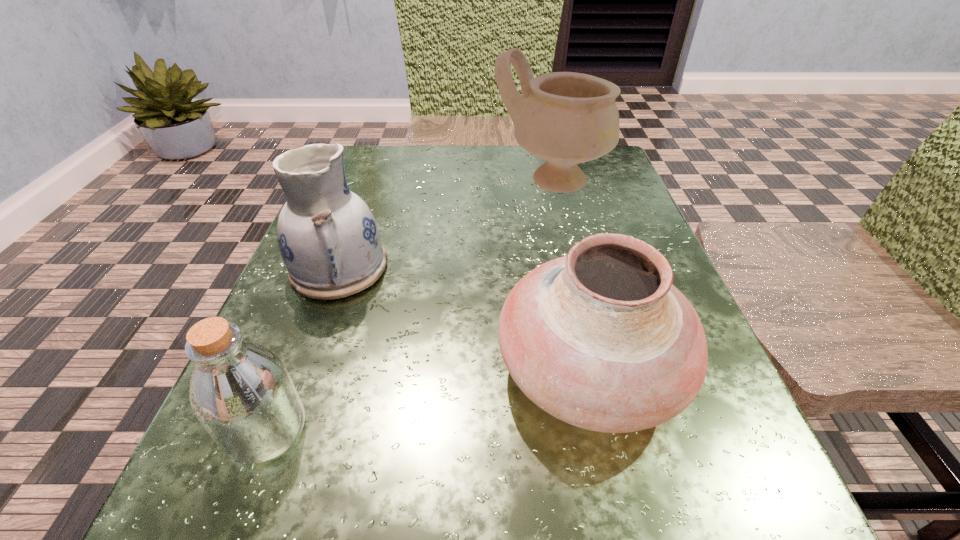
The height and width of the screenshot is (540, 960). In order to click on the farthest object in this screenshot , I will do `click(567, 118)`.

Locate an element on the screen. The width and height of the screenshot is (960, 540). the leftmost pottery is located at coordinates (328, 238).

Where is `the second farthest object`? The height and width of the screenshot is (540, 960). the second farthest object is located at coordinates point(328,238).

You are a GUI agent. You are given a task and a screenshot of the screen. Output one action in this format:
    pyautogui.click(x=<x>, y=<y>)
    Task: Click on the nearest pottery
    The width and height of the screenshot is (960, 540).
    Given the screenshot: What is the action you would take?
    pyautogui.click(x=601, y=339)

Identify the location of bottle. This screenshot has height=540, width=960. (241, 392).

Locate an element on the screen. Image resolution: width=960 pixels, height=540 pixels. free region located on the front of the farthest object is located at coordinates (591, 359).

Identify the location of free space located 0.190m on the back of the second nearest pottery. (370, 185).

The height and width of the screenshot is (540, 960). I want to click on vacant point located 0.190m on the back of the nearest pottery, so click(559, 232).

I want to click on free space located on the right of the bottle, so click(398, 430).

Identify the location of object that is at the far edge. [567, 118].